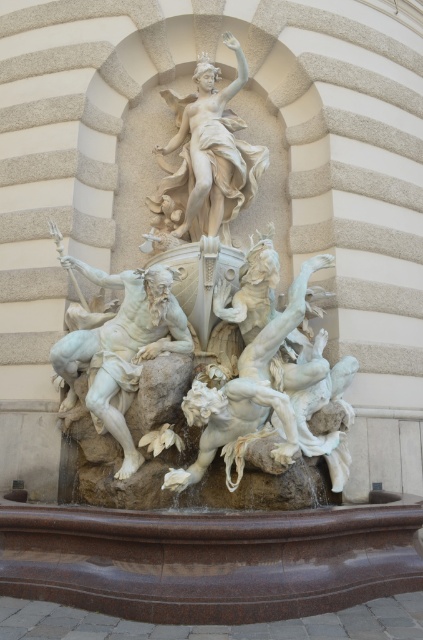
You are an art student standing in front of the sculpture ensemble. You want to take a photo of the white marble statue at center and the white marble statue at upper center. Which statue will appear larger in your photo?

The white marble statue at center will appear larger in the photo because it is closer to the viewer than the white marble statue at upper center.

You are an art conservator examining the sculpture ensemble. You notice two points of potential damage at coordinates point (198, 166) and point (128, 403). Which point is closer to the viewer?

Point (128, 403) is closer to the viewer because the description states that point (198, 166) is behind it.

Looking at the classical sculpture ensemble in the architectural niche, you notice the white marble statue at upper center and the white marble figure at center. Which one is positioned to the right side of the other?

The white marble statue at upper center is to the right of the white marble figure at center.